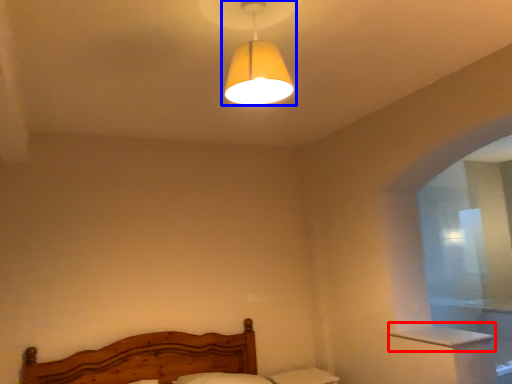
Question: Which object appears closest to the camera in this image, window sill (highlighted by a red box) or lamp (highlighted by a blue box)?

Choices:
 (A) window sill
 (B) lamp

Answer: (B)